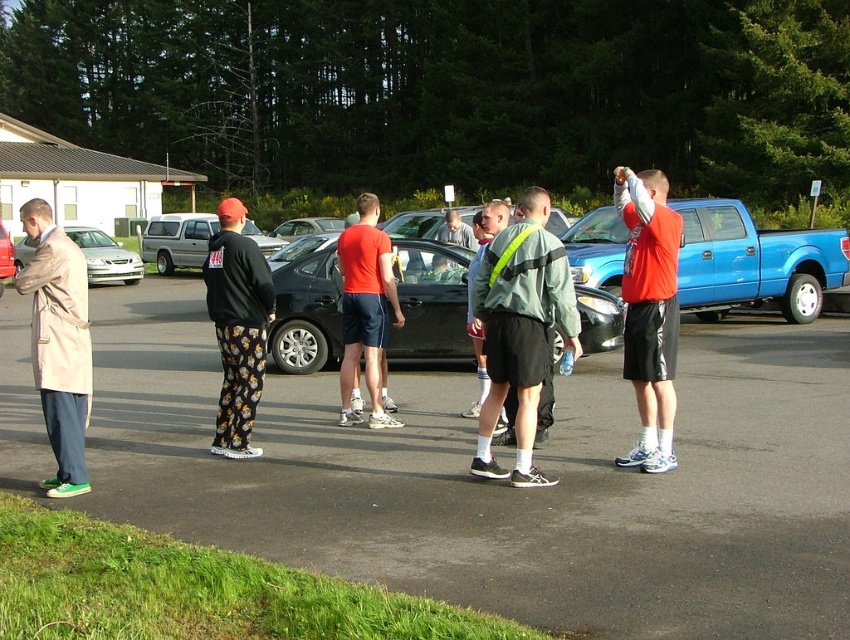
You are standing at point (462, 230) and want to walk to the black car in the parking lot. Is the black car closer to you or to point (618, 266)?

The black car is closer to point (618, 266) because point (618, 266) is in front of point (462, 230). Since you are at point (462, 230), the black car would be farther away from your current position compared to point (618, 266).

You need to park your car next to the blue matte truck at right and the matte red shirt at center. Which object should you avoid parking too close to because it is wider?

The matte red shirt at center is wider than the blue matte truck at right, so you should avoid parking too close to the matte red shirt at center to accommodate its width.

You are standing in the parking lot and want to walk from point (602,276) to point (81,442). Considering the spatial relationship between these two points, which direction should you move in to get closer to your destination?

To move from point (602,276) to point (81,442), you should move downward and to the right since point (81,442) is closer to the viewer and positioned lower and further to the right compared to point (602,276).